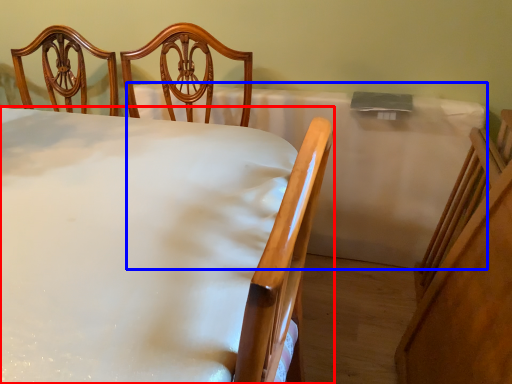
Question: Which object appears farthest to the camera in this image, furniture (highlighted by a red box) or tablecloth (highlighted by a blue box)?

Choices:
 (A) furniture
 (B) tablecloth

Answer: (B)